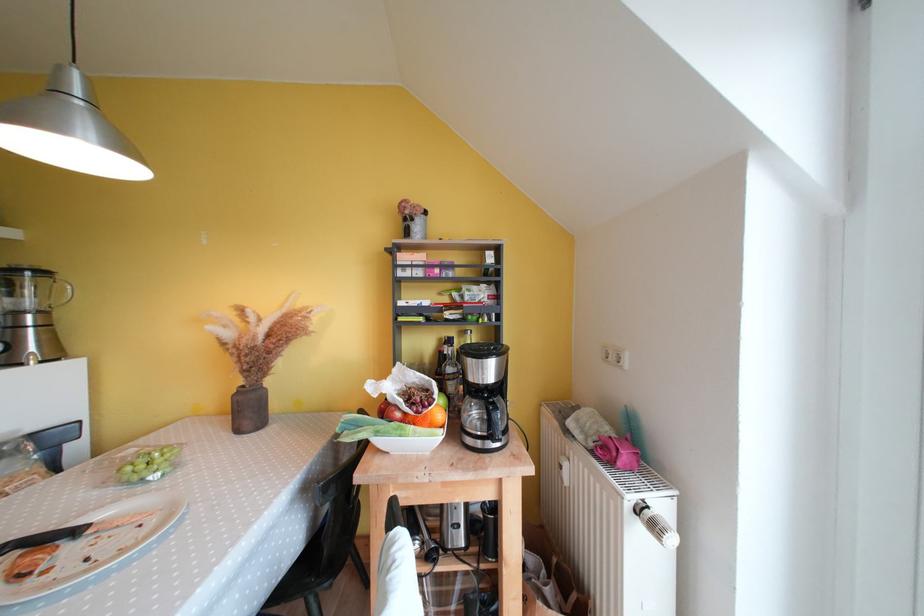
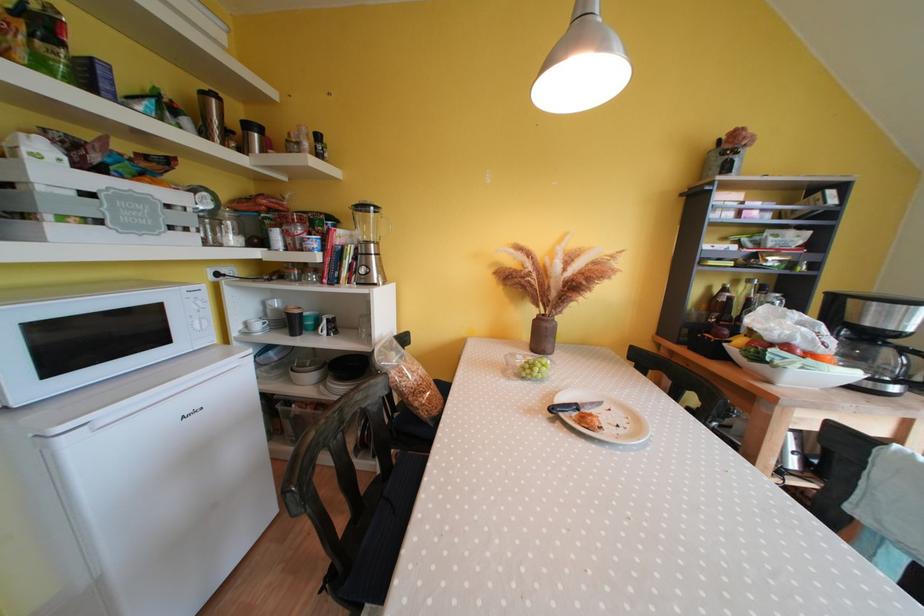
Locate, in the second image, the point that corresponds to point 83,535 in the first image.

(582, 410)